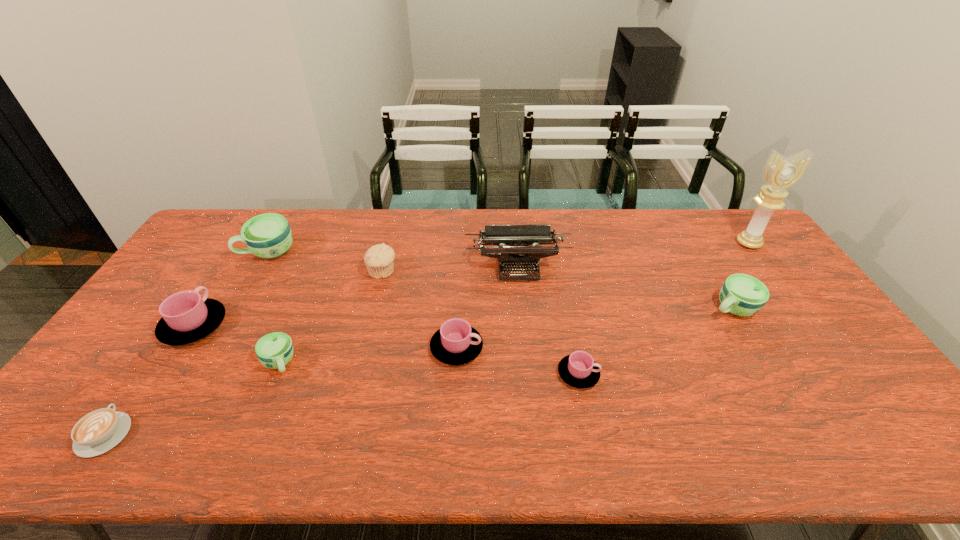
Where is `the second closest blue cup to the rightmost object`? Image resolution: width=960 pixels, height=540 pixels. the second closest blue cup to the rightmost object is located at coordinates (275, 350).

Select which blue cup is the closest to the farthest cup. Please provide its 2D coordinates. Your answer should be formatted as a tuple, i.e. [(x, y)], where the tuple contains the x and y coordinates of a point satisfying the conditions above.

[(275, 350)]

Choose which pink cup is the nearest neighbor to the typewriter. Please provide its 2D coordinates. Your answer should be formatted as a tuple, i.e. [(x, y)], where the tuple contains the x and y coordinates of a point satisfying the conditions above.

[(456, 343)]

Find the location of `the third closest pink cup to the cappuccino`. the third closest pink cup to the cappuccino is located at coordinates (579, 370).

Where is `blank area in the image that satisfies the following two spatial constraints: 1. on the front-facing side of the tallest object; 2. on the side with the handle of the smallest pink cup`? blank area in the image that satisfies the following two spatial constraints: 1. on the front-facing side of the tallest object; 2. on the side with the handle of the smallest pink cup is located at coordinates (845, 374).